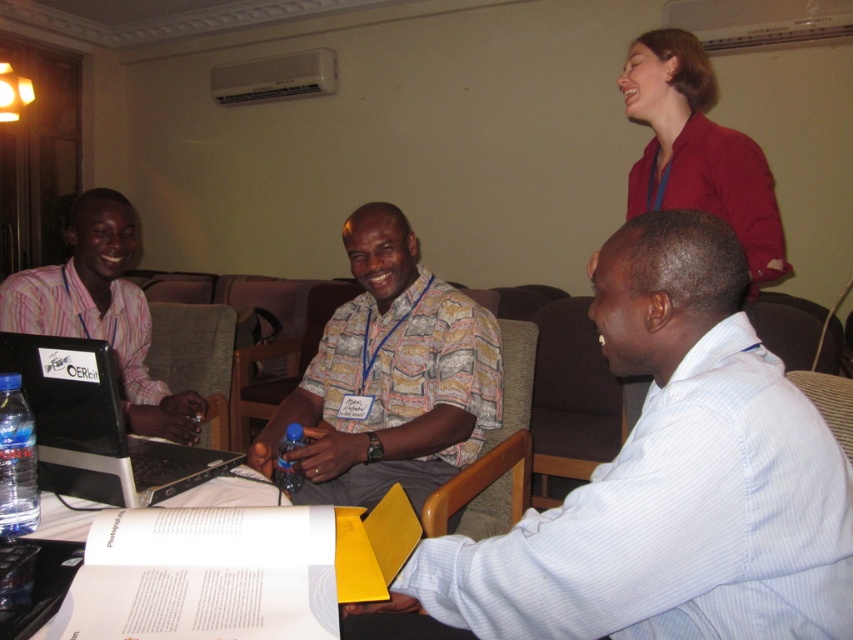
Where is `printed cotton shirt at center`? This screenshot has height=640, width=853. printed cotton shirt at center is located at coordinates (390, 378).

Does point (431, 451) lie behind point (198, 406)?

No, it is in front of (198, 406).

Which of these two, printed cotton shirt at center or matte pink shirt at left, stands taller?

printed cotton shirt at center

Image resolution: width=853 pixels, height=640 pixels. Find the location of `printed cotton shirt at center`. printed cotton shirt at center is located at coordinates (390, 378).

Which is below, matte pink shirt at left or blue plastic bottle at center?

blue plastic bottle at center is lower down.

Between matte pink shirt at left and blue plastic bottle at center, which one has less height?

blue plastic bottle at center is shorter.

What do you see at coordinates (102, 310) in the screenshot?
I see `matte pink shirt at left` at bounding box center [102, 310].

This screenshot has height=640, width=853. Identify the location of matte pink shirt at left. (102, 310).